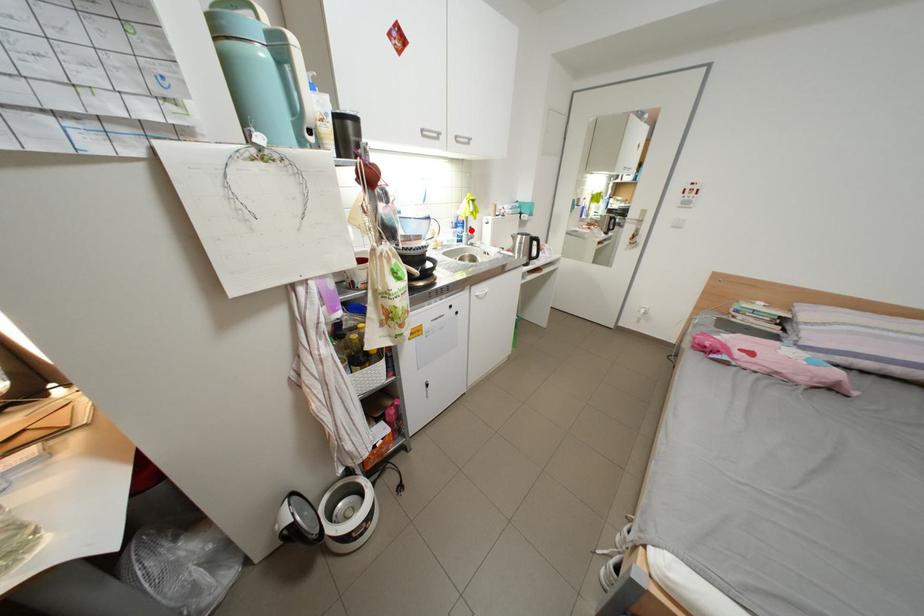
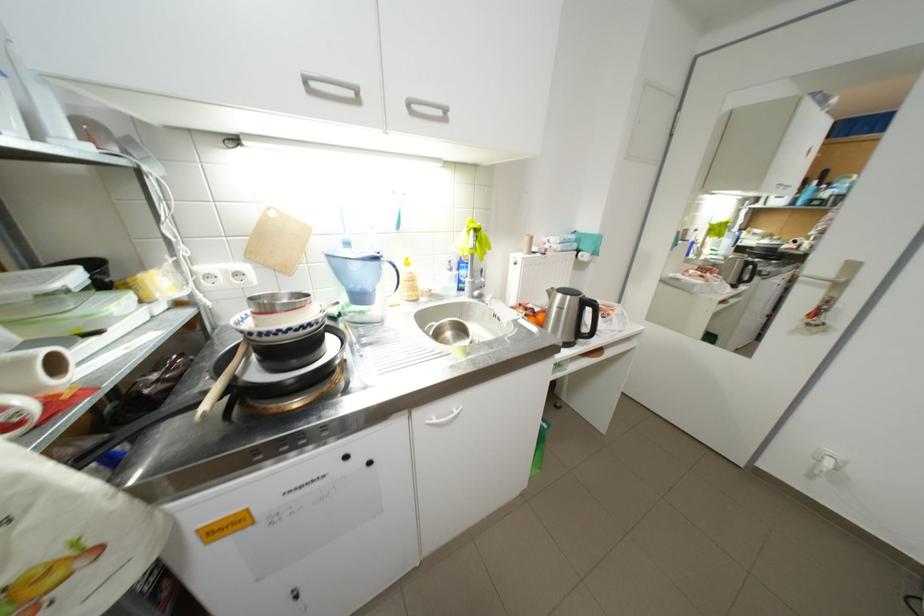
The point at the highlighted location is marked in the first image. Where is the corresponding point in the second image?

(475, 273)